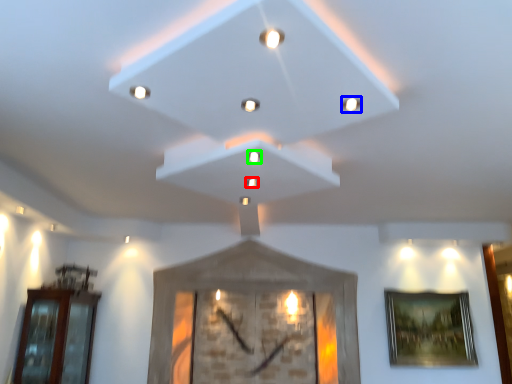
Question: Which object is positioned closest to light (highlighted by a red box)? Select from light (highlighted by a blue box) and light (highlighted by a green box).

Choices:
 (A) light
 (B) light

Answer: (B)